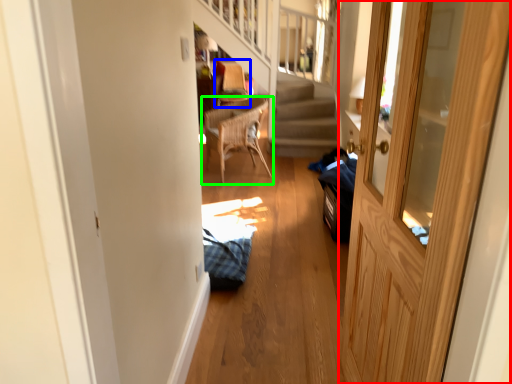
Question: Based on their relative distances, which object is nearer to door (highlighted by a red box)? Choose from armchair (highlighted by a blue box) and chair (highlighted by a green box).

Choices:
 (A) armchair
 (B) chair

Answer: (B)